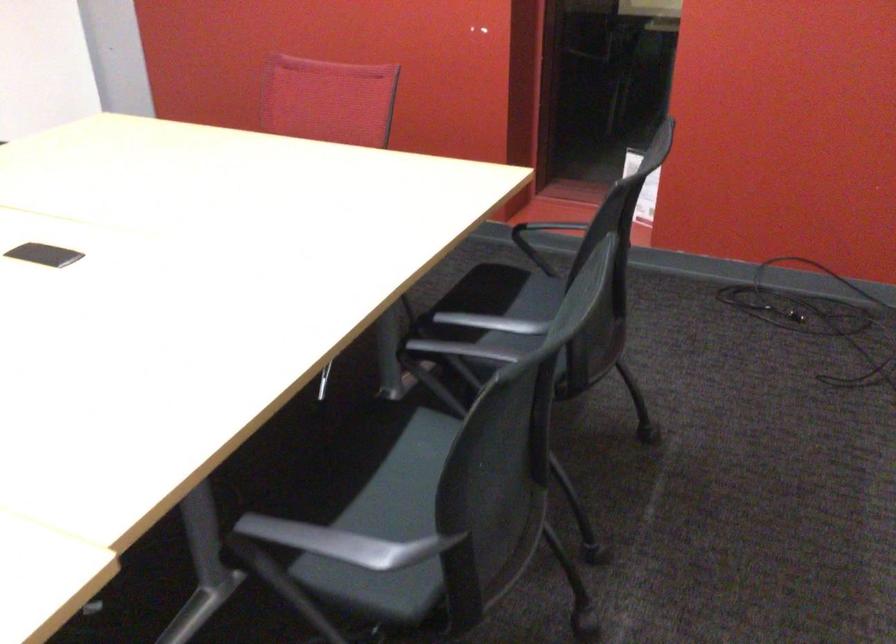
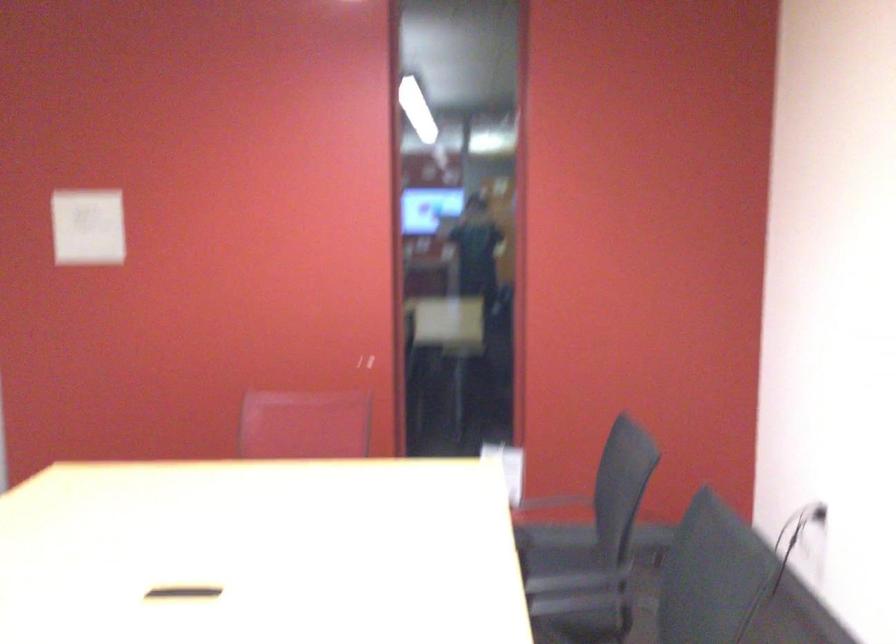
The point at (x=679, y=290) is marked in the first image. Where is the corresponding point in the second image?

(554, 547)